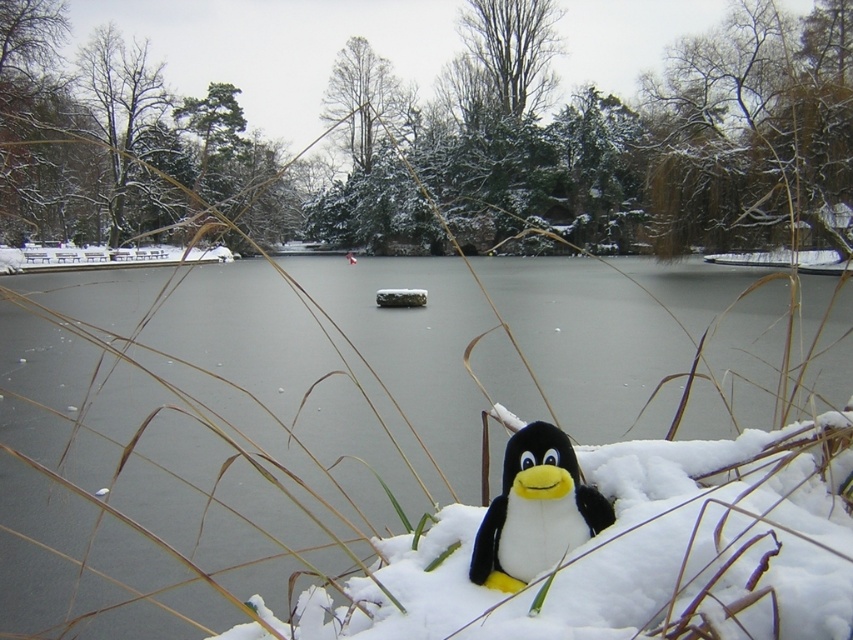
You are a photographer trying to capture the black plush penguin at lower center and the frozen water at center in the same frame. Based on their positions, will the penguin appear closer to the camera than the frozen water?

The black plush penguin at lower center is below frozen water at center, so yes, the penguin will appear closer to the camera than the frozen water.

You are standing at the edge of the frozen lake and want to reach the point marked at coordinates (523, 572). Given that your maximum comfortable walking distance is 30 inches, can you safely reach that point without straining?

The point marked at coordinates (523, 572) is 31.56 inches away from you, which exceeds your maximum comfortable walking distance of 30 inches. Therefore, reaching it would require some strain.

You are standing at the edge of the frozen lake and see two points marked on the ice. The first point is at coordinate point (x=654, y=547) and the second point is at coordinate point (x=361, y=278). Which point is closer to your current position?

Point (x=654, y=547) is closer to the camera than point (x=361, y=278), so the first point is closer to your current position.